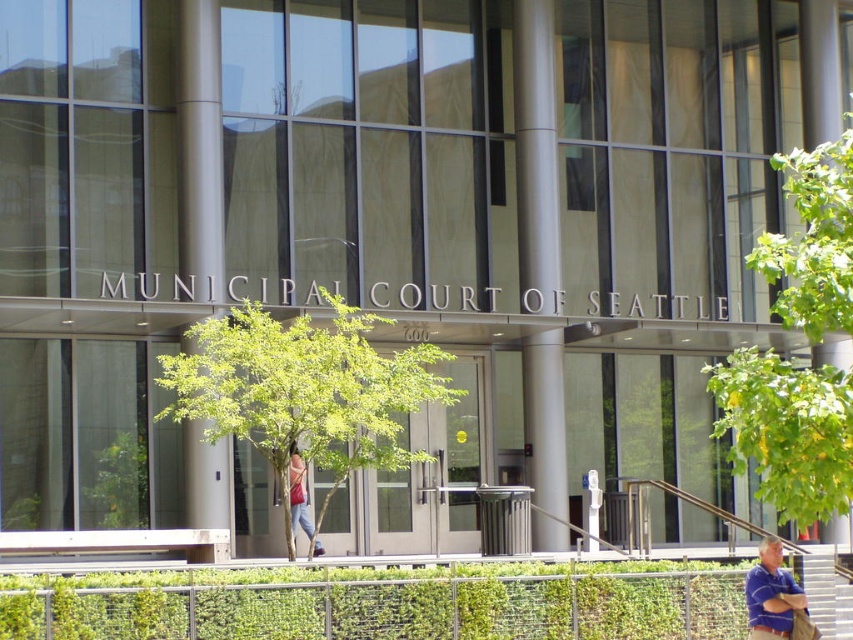
Question: Which object is closer to the camera taking this photo?

Choices:
 (A) green leafy tree at right
 (B) white plastic stairs at lower right
 (C) green leafy tree at center
 (D) green leafy hedge at lower center

Answer: (A)

Question: Can you confirm if green leafy hedge at lower center is positioned above green leafy tree at right?

Choices:
 (A) yes
 (B) no

Answer: (B)

Question: Based on their relative distances, which object is nearer to the blue striped shirt at lower right?

Choices:
 (A) white plastic stairs at lower right
 (B) green leafy tree at right

Answer: (A)

Question: Can you confirm if blue striped shirt at lower right is thinner than white plastic stairs at lower right?

Choices:
 (A) no
 (B) yes

Answer: (A)

Question: Which object is farther from the camera taking this photo?

Choices:
 (A) blue striped shirt at lower right
 (B) green leafy tree at center
 (C) green leafy hedge at lower center
 (D) matte pink bag at center

Answer: (D)

Question: Is green leafy tree at center positioned before white plastic stairs at lower right?

Choices:
 (A) yes
 (B) no

Answer: (A)